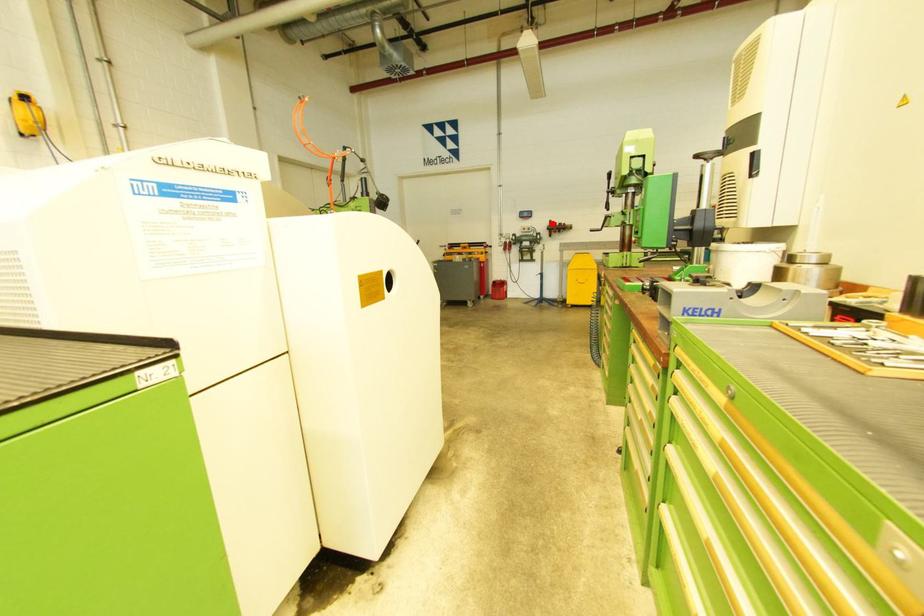
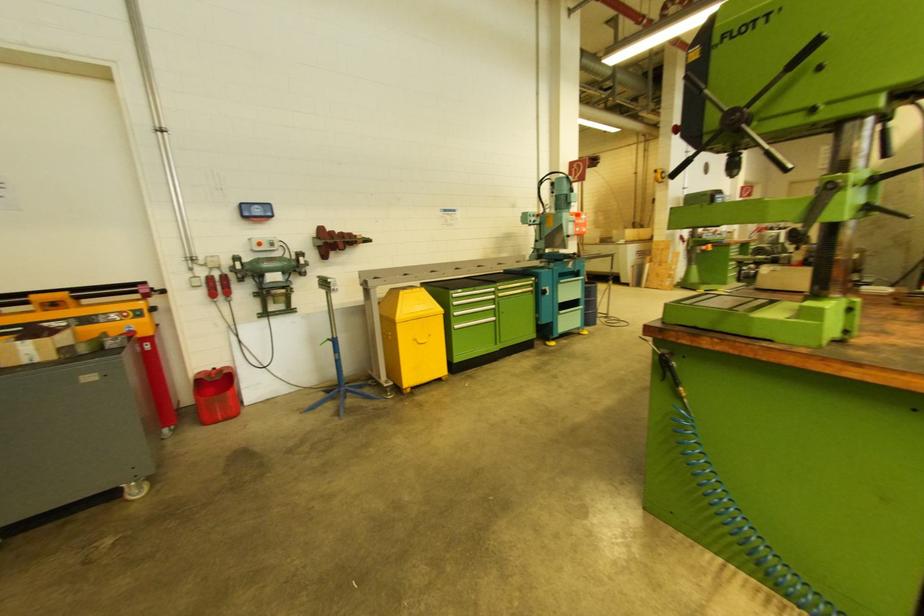
Question: A red point is marked in image1. In image2, is the corresponding 3D point closer to the camera or farther? Reply with the corresponding letter.

Choices:
 (A) The corresponding 3D point is closer.
 (B) The corresponding 3D point is farther.

Answer: (B)